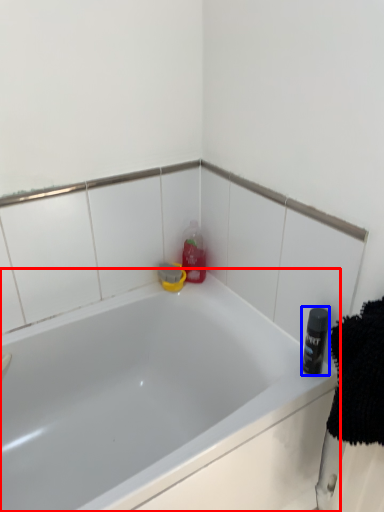
Question: Among these objects, which one is nearest to the camera, bathtub (highlighted by a red box) or toiletry (highlighted by a blue box)?

Choices:
 (A) bathtub
 (B) toiletry

Answer: (A)